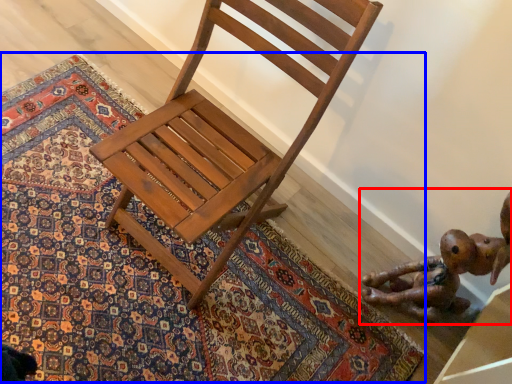
Question: Among these objects, which one is farthest to the camera, toy (highlighted by a red box) or mat (highlighted by a blue box)?

Choices:
 (A) toy
 (B) mat

Answer: (B)